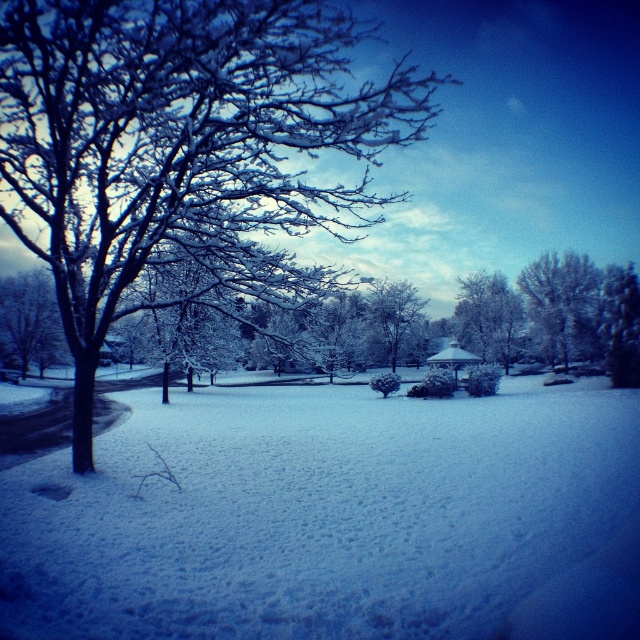
Describe the element at coordinates (561, 301) in the screenshot. The height and width of the screenshot is (640, 640). I see `white frosty tree at upper right` at that location.

Locate an element on the screen. The image size is (640, 640). white frosty tree at upper right is located at coordinates (561, 301).

This screenshot has height=640, width=640. In order to click on white frosty tree at upper right in this screenshot , I will do `click(561, 301)`.

Who is shorter, white fluffy snow at center or snowy bark tree at center?

white fluffy snow at center

Can you confirm if white fluffy snow at center is thinner than snowy bark tree at center?

No.

Between point (563, 509) and point (417, 298), which one is positioned in front?

Point (563, 509) is in front.

Where is `white fluffy snow at center`? white fluffy snow at center is located at coordinates (317, 513).

Can you confirm if white fluffy snow at center is positioned below white frosty tree at upper right?

Indeed, white fluffy snow at center is positioned under white frosty tree at upper right.

From the picture: Between white fluffy snow at center and white frosty tree at upper right, which one has more height?

With more height is white frosty tree at upper right.

Is point (506, 568) closer to camera compared to point (586, 292)?

Yes, point (506, 568) is closer to viewer.

Image resolution: width=640 pixels, height=640 pixels. I want to click on white fluffy snow at center, so pyautogui.click(x=317, y=513).